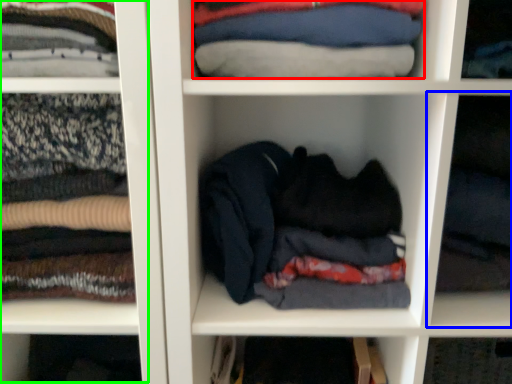
Question: Considering the real-world distances, which object is farthest from clothing (highlighted by a red box)? cabinet (highlighted by a blue box) or cabinet (highlighted by a green box)?

Choices:
 (A) cabinet
 (B) cabinet

Answer: (A)